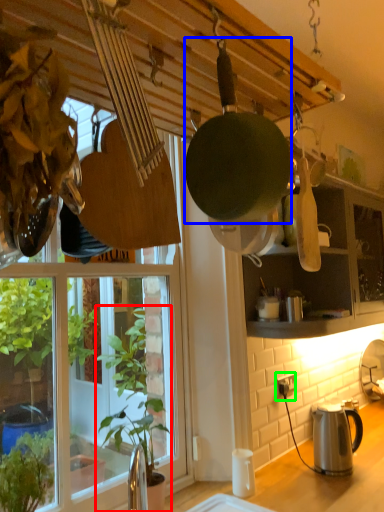
Question: Considering the real-world distances, which object is farthest from houseplant (highlighted by a red box)? frying pan (highlighted by a blue box) or power outlet (highlighted by a green box)?

Choices:
 (A) frying pan
 (B) power outlet

Answer: (A)